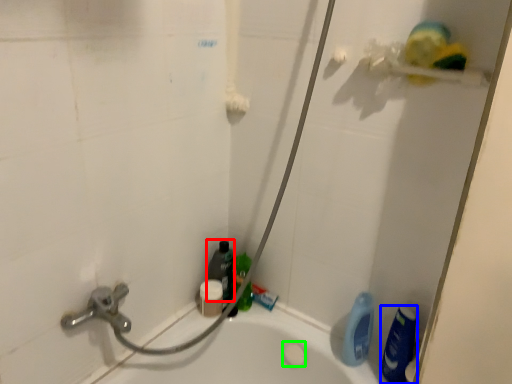
Question: Considering the real-world distances, which object is farthest from cleaning product (highlighted by a red box)? cleaning product (highlighted by a blue box) or soap (highlighted by a green box)?

Choices:
 (A) cleaning product
 (B) soap

Answer: (A)